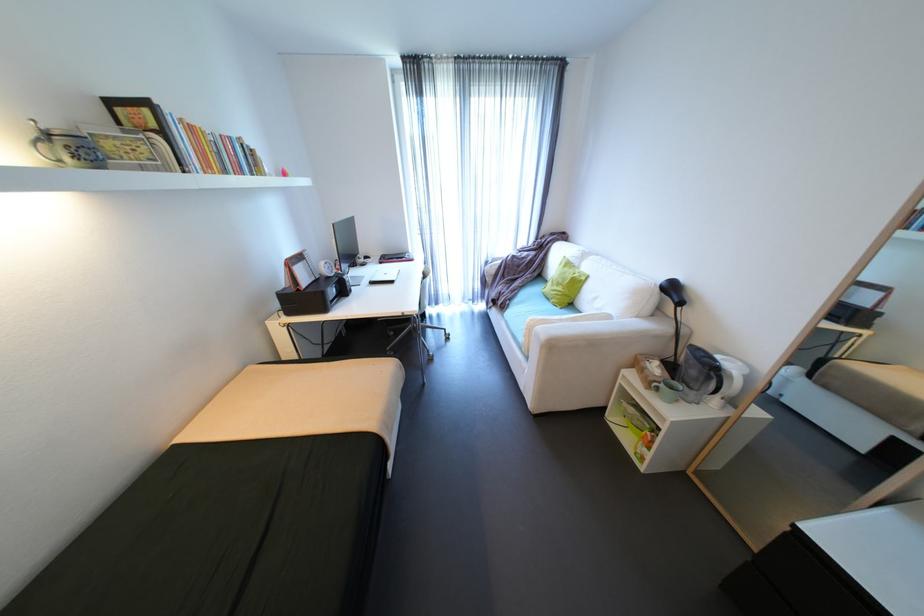
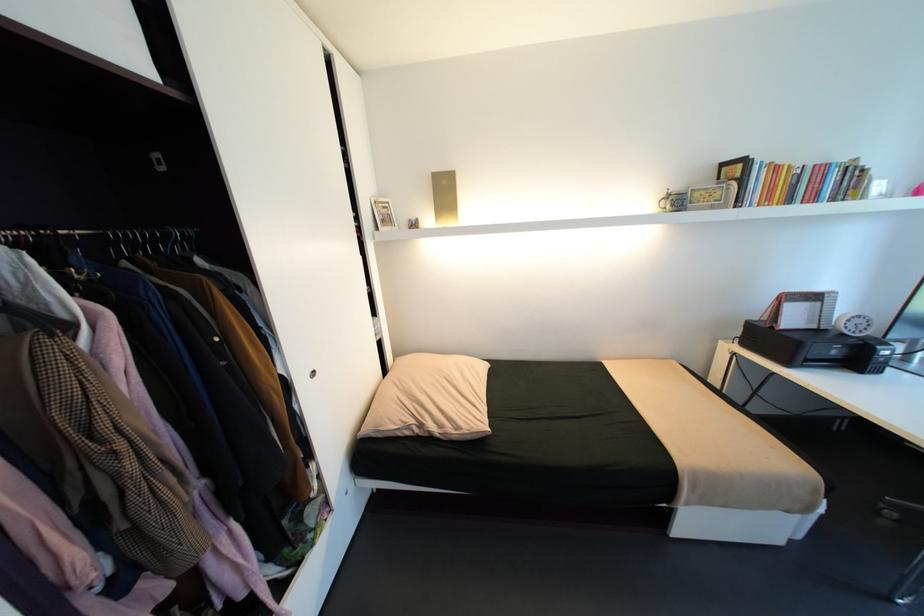
Based on the continuous images, in which direction is the camera rotating?

The camera's rotation is toward left-down.